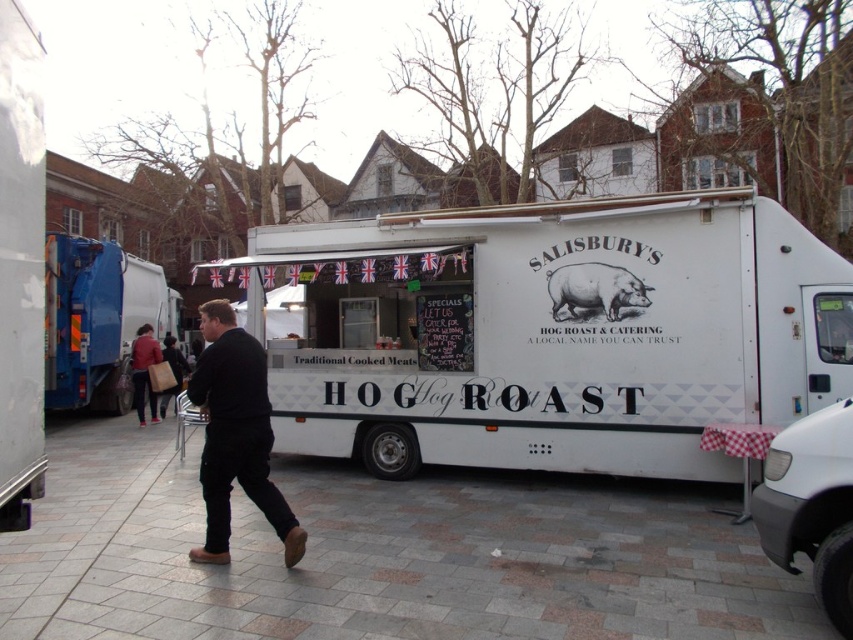
You are a customer waiting in line at the catering truck. You notice the gray concrete pavement at lower center and the dark blue jeans at center. Which object is taller from your perspective?

The dark blue jeans at center are taller than the gray concrete pavement at lower center.

You are a pedestrian standing on the sidewalk next to the white catering truck. You notice the blue metallic garbage truck at left and the matte red jacket at left. Which object is closer to you?

The blue metallic garbage truck at left is closer to you because it is in front of the matte red jacket at left.